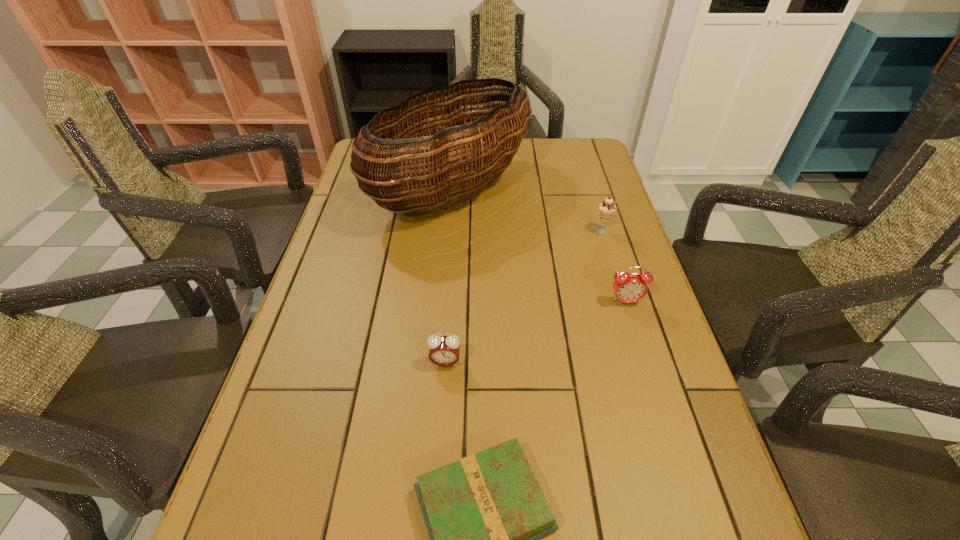
Image resolution: width=960 pixels, height=540 pixels. Find the location of `object at the far edge`. object at the far edge is located at coordinates (469, 149).

Where is `object positioned at the left edge`? The image size is (960, 540). object positioned at the left edge is located at coordinates (469, 149).

Where is `icecream present at the right edge`? The height and width of the screenshot is (540, 960). icecream present at the right edge is located at coordinates (607, 208).

In order to click on alarm clock that is at the right edge in this screenshot , I will do `click(628, 288)`.

Find the location of a particular element. object at the far left corner is located at coordinates (469, 149).

This screenshot has width=960, height=540. Find the location of `free space at the left edge of the desktop`. free space at the left edge of the desktop is located at coordinates (x=343, y=310).

Find the location of a particular element. The width and height of the screenshot is (960, 540). free space at the right edge is located at coordinates (729, 530).

Where is `free space at the far right corner`? free space at the far right corner is located at coordinates (590, 170).

Locate an element on the screen. Image resolution: width=960 pixels, height=540 pixels. free space between the icecream and the nearer alarm clock is located at coordinates (524, 297).

At what (x,y) coordinates should I click in order to perform the action: click on vacant space in between the left alarm clock and the icecream. Please return your answer as a coordinate pair (x, y). Looking at the image, I should click on click(524, 297).